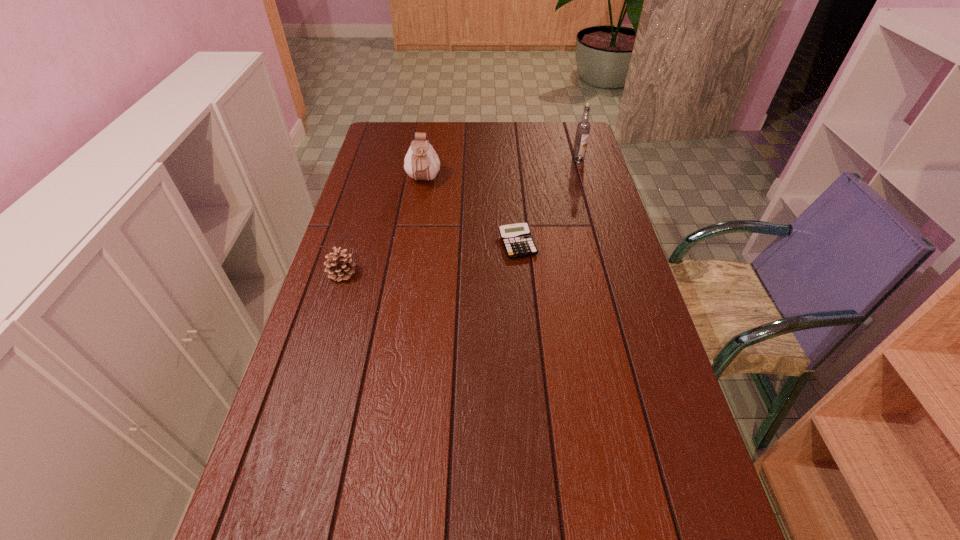
Image resolution: width=960 pixels, height=540 pixels. In order to click on the farthest object in this screenshot , I will do `click(583, 128)`.

Where is `the tallest object`? The height and width of the screenshot is (540, 960). the tallest object is located at coordinates (583, 128).

Locate an element on the screen. Image resolution: width=960 pixels, height=540 pixels. the second tallest object is located at coordinates (421, 162).

The width and height of the screenshot is (960, 540). I want to click on the second object from left to right, so click(x=421, y=162).

Find the location of a particular element. The height and width of the screenshot is (540, 960). the leftmost object is located at coordinates (339, 265).

I want to click on the nearest object, so click(339, 265).

You are a GUI agent. You are given a task and a screenshot of the screen. Output one action in this format:
    pyautogui.click(x=<x>, y=<y>)
    Task: Click on the shortest object
    The image size is (960, 540).
    Given the screenshot: What is the action you would take?
    pyautogui.click(x=517, y=241)

Image resolution: width=960 pixels, height=540 pixels. In order to click on the second nearest object in this screenshot , I will do (517, 241).

This screenshot has height=540, width=960. I want to click on vacant space located on the label of the rightmost object, so click(x=583, y=176).

Where is `free space located on the front-facing side of the third object from right to left`? free space located on the front-facing side of the third object from right to left is located at coordinates (417, 223).